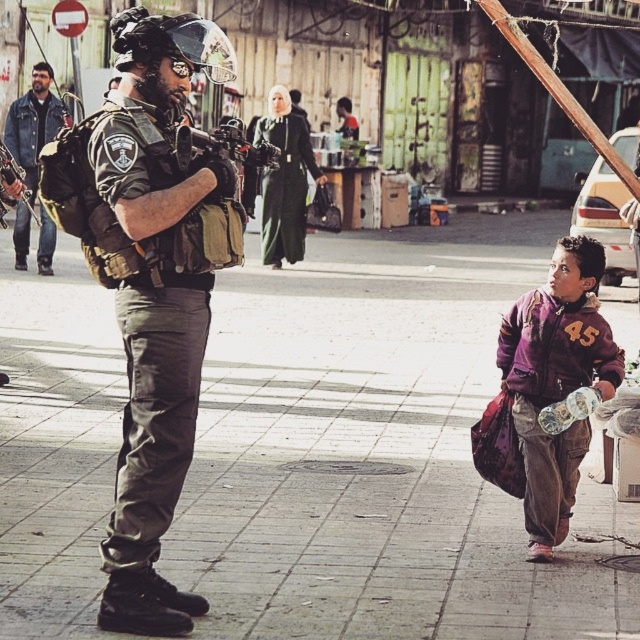
You are a pedestrian trying to cross the street and see the camouflage uniform at center and the purple fleece jacket at lower right. Which one is closer to you?

The camouflage uniform at center is closer to you because it is in front of the purple fleece jacket at lower right.

You are a tailor who needs to determine which jacket requires more fabric to make between the purple fleece jacket at lower right and the denim jacket at left. Based on their sizes, which one would need more fabric?

The denim jacket at left requires more fabric because its width is greater than the purple fleece jacket at lower right.